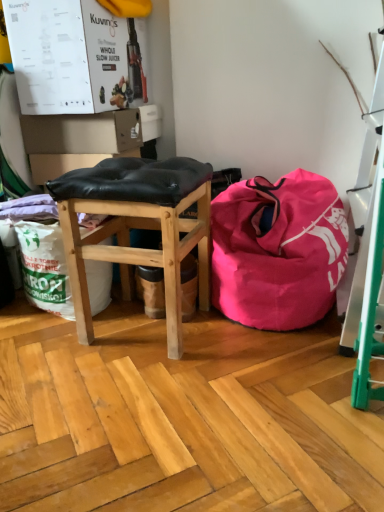
Question: Is pink fabric bean bag at center to the left of black leather stool at center from the viewer's perspective?

Choices:
 (A) yes
 (B) no

Answer: (B)

Question: Does pink fabric bean bag at center turn towards black leather stool at center?

Choices:
 (A) yes
 (B) no

Answer: (B)

Question: Is black leather stool at center completely or partially inside pink fabric bean bag at center?

Choices:
 (A) yes
 (B) no

Answer: (B)

Question: Is the depth of pink fabric bean bag at center less than that of black leather stool at center?

Choices:
 (A) yes
 (B) no

Answer: (B)

Question: Can you confirm if pink fabric bean bag at center is bigger than black leather stool at center?

Choices:
 (A) yes
 (B) no

Answer: (A)

Question: Can you confirm if pink fabric bean bag at center is smaller than black leather stool at center?

Choices:
 (A) no
 (B) yes

Answer: (A)

Question: From a real-world perspective, is black leather stool at center on pink fabric bean bag at center?

Choices:
 (A) no
 (B) yes

Answer: (B)

Question: From the image's perspective, is black leather stool at center over pink fabric bean bag at center?

Choices:
 (A) yes
 (B) no

Answer: (B)

Question: Is black leather stool at center positioned before pink fabric bean bag at center?

Choices:
 (A) no
 (B) yes

Answer: (B)

Question: Is black leather stool at center at the right side of pink fabric bean bag at center?

Choices:
 (A) yes
 (B) no

Answer: (B)

Question: Are black leather stool at center and pink fabric bean bag at center located far from each other?

Choices:
 (A) yes
 (B) no

Answer: (B)

Question: Is black leather stool at center positioned with its back to pink fabric bean bag at center?

Choices:
 (A) no
 (B) yes

Answer: (A)

Question: Relative to pink fabric bean bag at center, is black leather stool at center in front or behind?

Choices:
 (A) front
 (B) behind

Answer: (A)